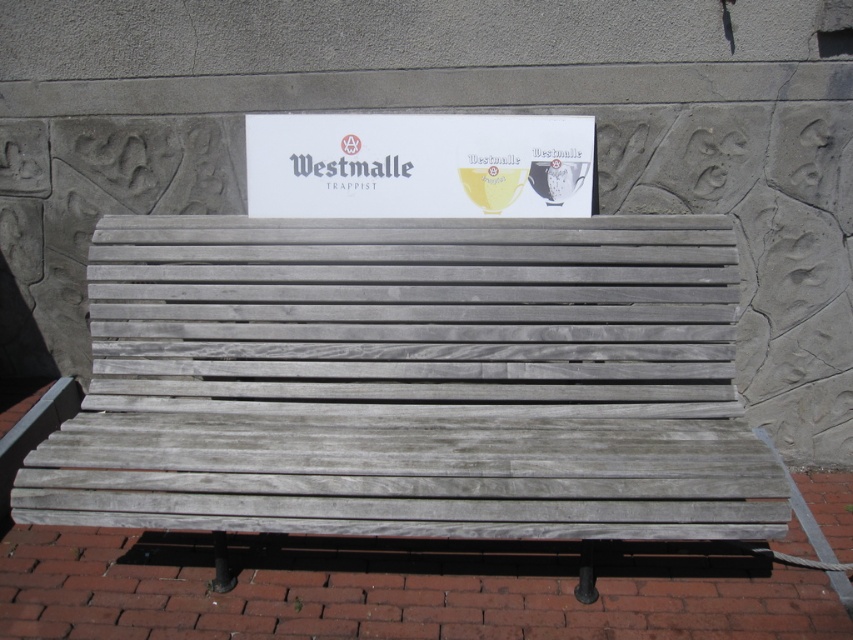
Question: Is weathered wood bench at center wider than white paper sign at center?

Choices:
 (A) no
 (B) yes

Answer: (B)

Question: Which object is closer to the camera taking this photo?

Choices:
 (A) white paper sign at center
 (B) weathered wood bench at center

Answer: (B)

Question: Is weathered wood bench at center behind white paper sign at center?

Choices:
 (A) yes
 (B) no

Answer: (B)

Question: Which point is closer to the camera?

Choices:
 (A) (701, 268)
 (B) (412, 132)

Answer: (A)

Question: Is weathered wood bench at center thinner than white paper sign at center?

Choices:
 (A) no
 (B) yes

Answer: (A)

Question: Among these objects, which one is nearest to the camera?

Choices:
 (A) white paper sign at center
 (B) weathered wood bench at center

Answer: (B)